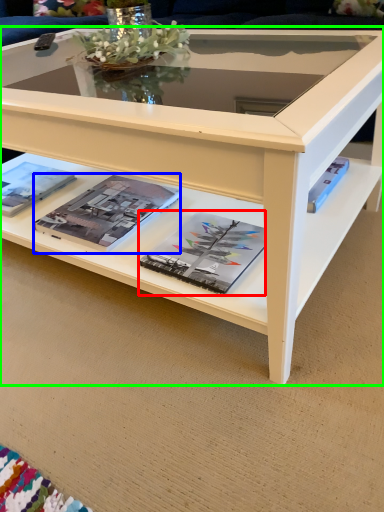
Question: Which is nearer to the magazine (highlighted by a red box)? magazine (highlighted by a blue box) or coffee table (highlighted by a green box).

Choices:
 (A) magazine
 (B) coffee table

Answer: (A)